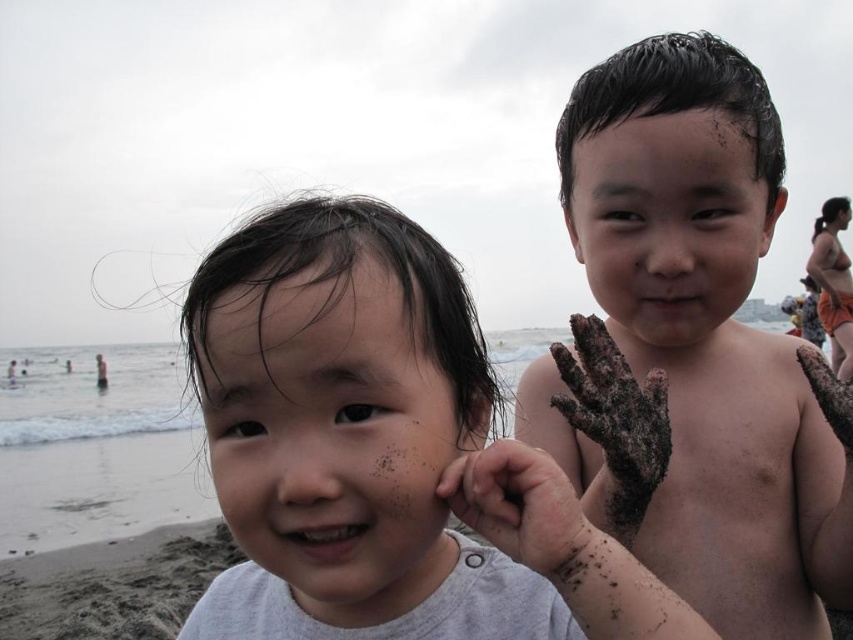
Question: Is smooth skin child at center positioned behind smooth skin face at center?

Choices:
 (A) no
 (B) yes

Answer: (B)

Question: Can you confirm if dark wet hair at upper right is thinner than brown sandy mud at lower left?

Choices:
 (A) no
 (B) yes

Answer: (B)

Question: Which object is positioned closest to the dark wet hair at upper right?

Choices:
 (A) smooth skin face at center
 (B) smooth skin child at center

Answer: (B)

Question: Which point is farther to the camera?

Choices:
 (A) dark wet hair at upper right
 (B) smooth skin face at center
 (C) dark brown skin at right

Answer: (C)

Question: Among these objects, which one is nearest to the camera?

Choices:
 (A) smooth skin face at center
 (B) dark wet hair at upper right
 (C) brown sandy mud at lower left

Answer: (A)

Question: Is smooth skin child at center thinner than dark wet hair at upper right?

Choices:
 (A) no
 (B) yes

Answer: (A)